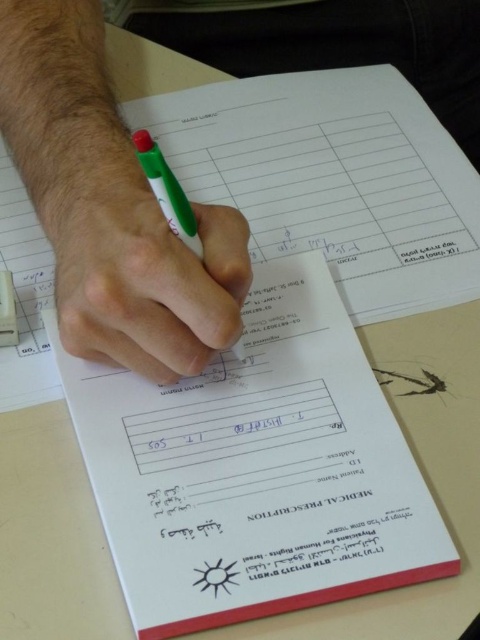
Question: Among these objects, which one is nearest to the camera?

Choices:
 (A) green matte pen at center
 (B) white paper at center

Answer: (B)

Question: Considering the relative positions of green plastic pen at upper left and green matte pen at center in the image provided, where is green plastic pen at upper left located with respect to green matte pen at center?

Choices:
 (A) left
 (B) right

Answer: (A)

Question: Is green plastic pen at upper left smaller than green plastic pen at center?

Choices:
 (A) yes
 (B) no

Answer: (B)

Question: Which object appears farthest from the camera in this image?

Choices:
 (A) green plastic pen at upper left
 (B) white paper at center
 (C) green plastic pen at center
 (D) green matte pen at center

Answer: (A)

Question: Which point is farther to the camera?

Choices:
 (A) white paper at center
 (B) green matte pen at center
 (C) green plastic pen at center

Answer: (B)

Question: Can you confirm if green matte pen at center is bigger than green plastic pen at center?

Choices:
 (A) yes
 (B) no

Answer: (A)